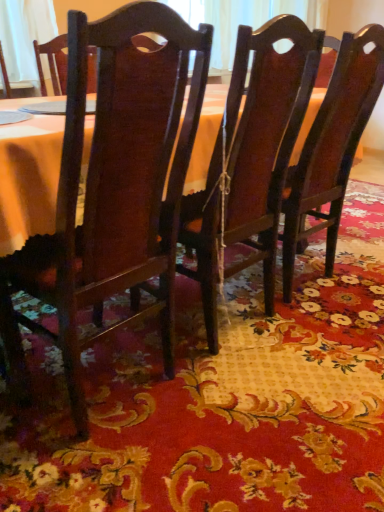
Question: From the image's perspective, relative to glossy wood chair at center, the first chair in the right-to-left sequence, is floral-patterned fabric at center above or below?

Choices:
 (A) above
 (B) below

Answer: (B)

Question: From a real-world perspective, is floral-patterned fabric at center positioned above or below glossy wood chair at center, which is counted as the third chair, starting from the left?

Choices:
 (A) above
 (B) below

Answer: (B)

Question: Which object is positioned closest to the matte wood chair at center, arranged as the third chair when viewed from the right?

Choices:
 (A) glossy wood chair at center, which is counted as the third chair, starting from the left
 (B) floral-patterned fabric at center
 (C) dark wood chair at center, which is counted as the 2th chair, starting from the left

Answer: (C)

Question: Considering the real-world distances, which object is farthest from the floral-patterned fabric at center?

Choices:
 (A) dark wood chair at center, which is counted as the 2th chair, starting from the left
 (B) glossy wood chair at center, which is counted as the third chair, starting from the left
 (C) matte wood chair at center, arranged as the third chair when viewed from the right

Answer: (B)